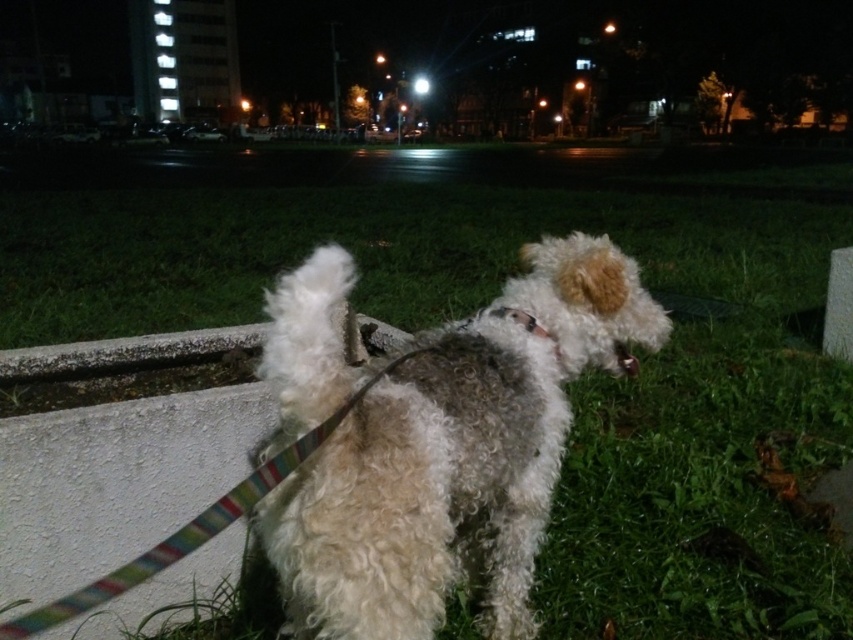
Is curly fur dog at center taller than white fabric neckband at center?

Yes.

Is point (602, 314) positioned before point (517, 314)?

No, (602, 314) is further to viewer.

This screenshot has height=640, width=853. What are the coordinates of `curly fur dog at center` in the screenshot? It's located at (454, 458).